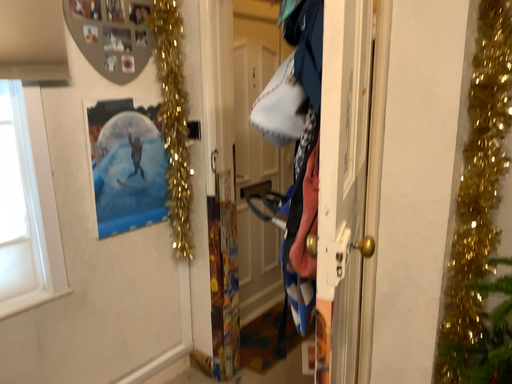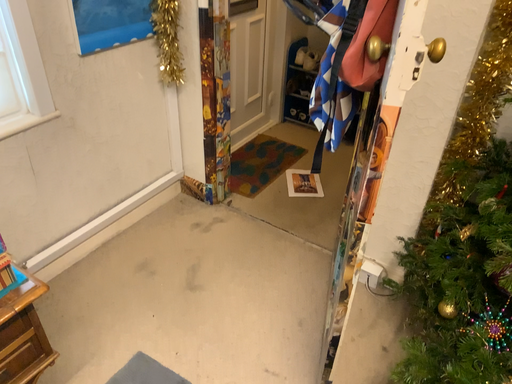
Question: How did the camera likely rotate when shooting the video?

Choices:
 (A) rotated downward
 (B) rotated upward

Answer: (A)